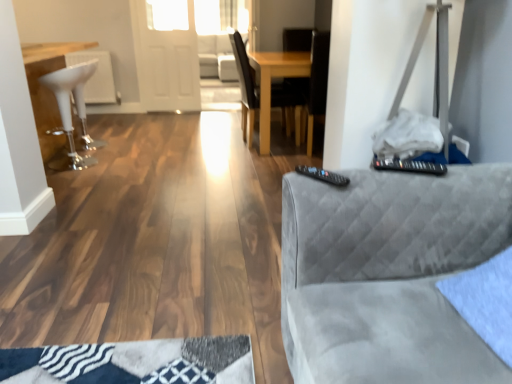
Question: Can you confirm if white glossy bar stool at left is wider than black plastic remote at right?

Choices:
 (A) no
 (B) yes

Answer: (B)

Question: Does white glossy bar stool at left have a lesser width compared to black plastic remote at right?

Choices:
 (A) yes
 (B) no

Answer: (B)

Question: Is white glossy bar stool at left looking in the opposite direction of black plastic remote at right?

Choices:
 (A) yes
 (B) no

Answer: (B)

Question: Does white glossy bar stool at left lie in front of black plastic remote at right?

Choices:
 (A) no
 (B) yes

Answer: (A)

Question: Is white glossy bar stool at left further to the viewer compared to black plastic remote at right?

Choices:
 (A) yes
 (B) no

Answer: (A)

Question: Do you think white fabric couch at center is within white glossy bar stool at left, or outside of it?

Choices:
 (A) inside
 (B) outside

Answer: (B)

Question: Considering the positions of white fabric couch at center and white glossy bar stool at left in the image, is white fabric couch at center taller or shorter than white glossy bar stool at left?

Choices:
 (A) tall
 (B) short

Answer: (A)

Question: In terms of size, does white fabric couch at center appear bigger or smaller than white glossy bar stool at left?

Choices:
 (A) small
 (B) big

Answer: (B)

Question: From the image's perspective, is white fabric couch at center located above or below white glossy bar stool at left?

Choices:
 (A) below
 (B) above

Answer: (B)

Question: Which is correct: suede gray couch at right is inside white fabric couch at center, or outside of it?

Choices:
 (A) outside
 (B) inside

Answer: (A)

Question: From a real-world perspective, relative to white fabric couch at center, is suede gray couch at right vertically above or below?

Choices:
 (A) above
 (B) below

Answer: (A)

Question: From the image's perspective, is suede gray couch at right positioned above or below white fabric couch at center?

Choices:
 (A) above
 (B) below

Answer: (B)

Question: Considering the relative positions of suede gray couch at right and white fabric couch at center in the image provided, is suede gray couch at right to the left or to the right of white fabric couch at center?

Choices:
 (A) left
 (B) right

Answer: (B)

Question: Is transparent glass door at upper center inside or outside of white glossy bar stool at left?

Choices:
 (A) outside
 (B) inside

Answer: (A)

Question: Based on their positions, is transparent glass door at upper center located to the left or right of white glossy bar stool at left?

Choices:
 (A) right
 (B) left

Answer: (A)